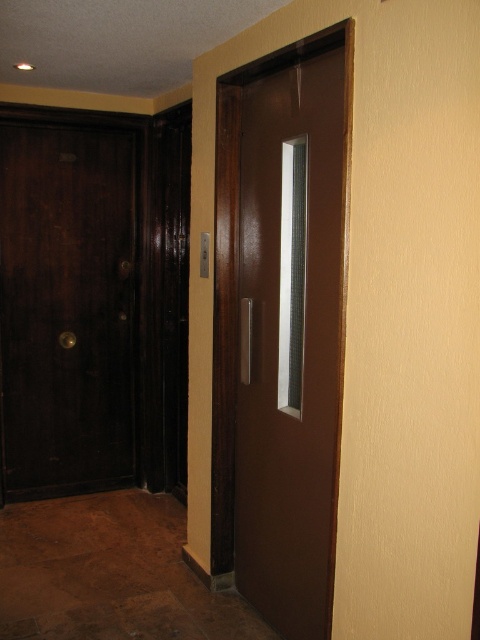
The width and height of the screenshot is (480, 640). Describe the element at coordinates (288, 342) in the screenshot. I see `glossy brown door at center` at that location.

What do you see at coordinates (288, 342) in the screenshot?
I see `glossy brown door at center` at bounding box center [288, 342].

Where is `glossy brown door at center`? glossy brown door at center is located at coordinates pyautogui.click(x=288, y=342).